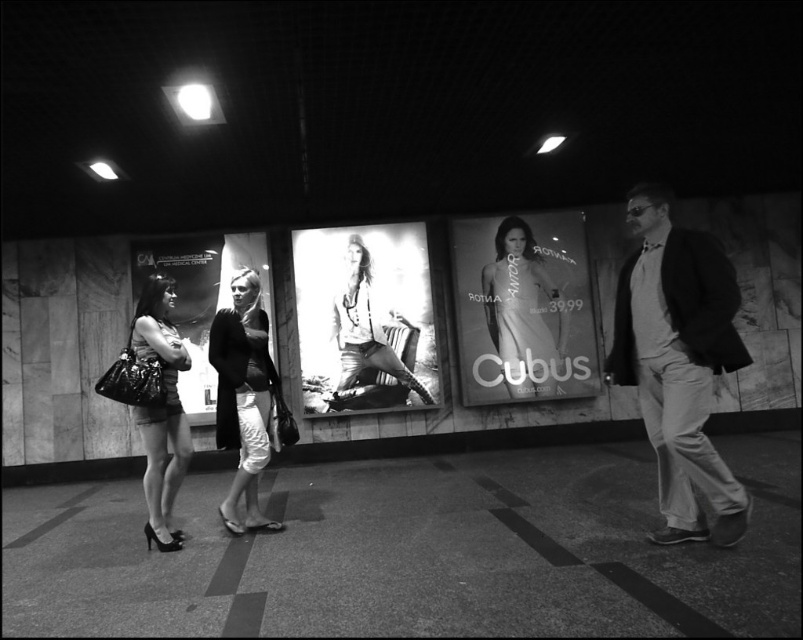
You are a delivery robot with a 2.5 meter arm reach. You need to place a package on the shiny black purse at center while standing at the position of the light gray cotton pants at right. Can your arm reach the purse?

The distance between light gray cotton pants at right and shiny black purse at center is 2.53 meters. Since your arm can only reach 2.5 meters, it is 3 centimeters too short to reach the purse.